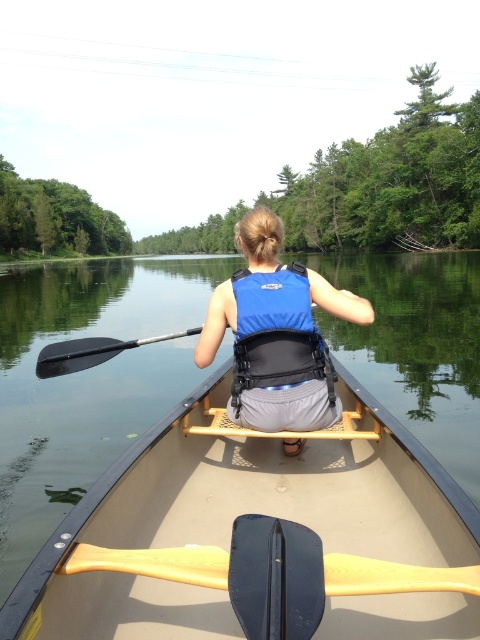
Question: Which of the following is the farthest from the observer?

Choices:
 (A) black rubber paddle at left
 (B) blue fabric life vest at center

Answer: (A)

Question: Which object is closer to the camera taking this photo?

Choices:
 (A) wooden paddle at center
 (B) tan plastic canoe at center

Answer: (B)

Question: Does wooden paddle at center have a larger size compared to blue matte life jacket at center?

Choices:
 (A) no
 (B) yes

Answer: (A)

Question: Which object is the farthest from the black rubber paddle at left?

Choices:
 (A) tan plastic canoe at center
 (B) blue matte life jacket at center

Answer: (A)

Question: Can you confirm if blue fabric life vest at center is bigger than wooden paddle at center?

Choices:
 (A) no
 (B) yes

Answer: (B)

Question: Is blue fabric life vest at center further to the viewer compared to wooden paddle at center?

Choices:
 (A) yes
 (B) no

Answer: (A)